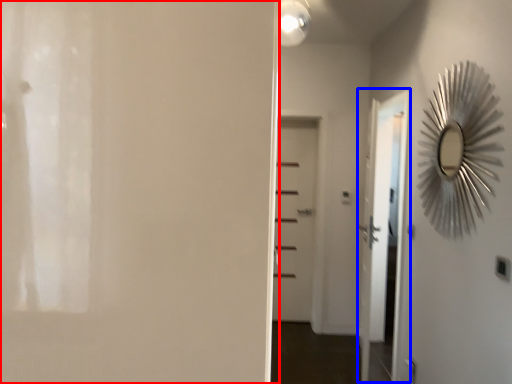
Question: Which point is closer to the camera, door (highlighted by a red box) or screen door (highlighted by a blue box)?

Choices:
 (A) door
 (B) screen door

Answer: (A)